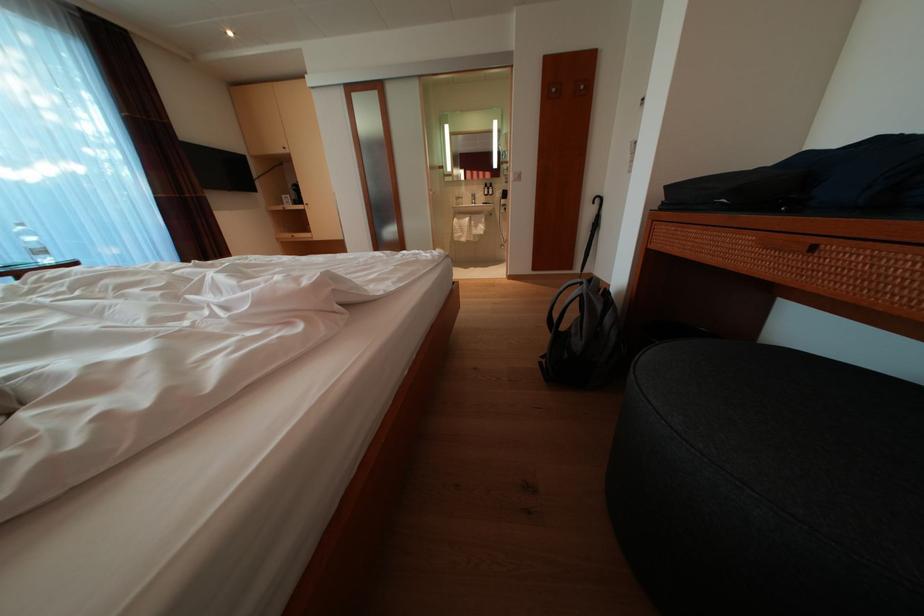
Where is `white hand towel`? white hand towel is located at coordinates [468, 227].